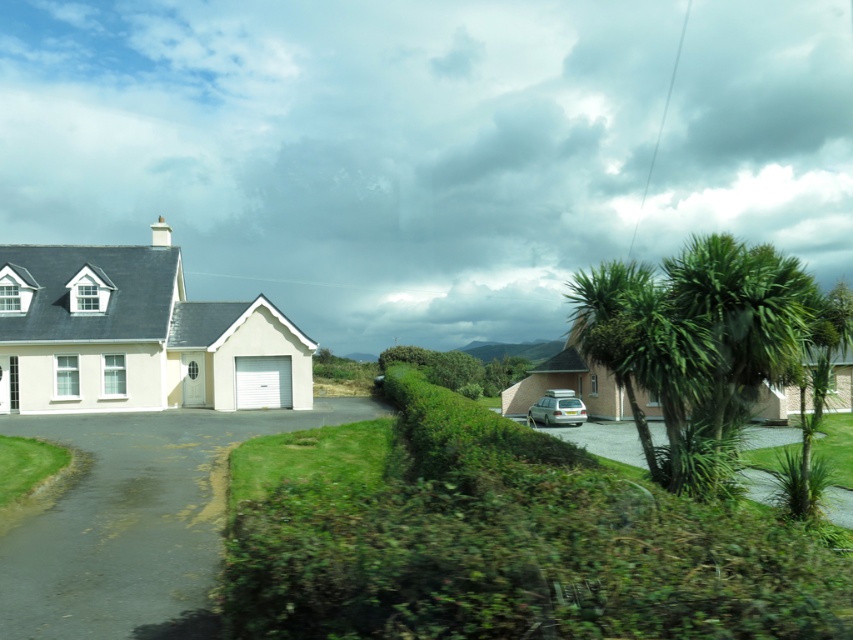
Question: Which point appears closest to the camera in this image?

Choices:
 (A) (761, 445)
 (B) (107, 256)
 (C) (151, 508)

Answer: (C)

Question: Which point is closer to the camera?

Choices:
 (A) gray asphalt driveway at lower left
 (B) white matte garage at left
 (C) green leafy palm tree at right
 (D) silver metallic car at center-right

Answer: (A)

Question: Does green leafy palm tree at right appear over gray asphalt driveway at lower center?

Choices:
 (A) yes
 (B) no

Answer: (A)

Question: In this image, where is gray asphalt driveway at lower left located relative to white matte garage at left?

Choices:
 (A) left
 (B) right

Answer: (B)

Question: Can you confirm if white matte garage at left is positioned below gray asphalt driveway at lower center?

Choices:
 (A) yes
 (B) no

Answer: (B)

Question: Which object appears farthest from the camera in this image?

Choices:
 (A) green leafy palm tree at right
 (B) gray asphalt driveway at lower center
 (C) silver metallic car at center-right
 (D) white matte garage at left

Answer: (C)